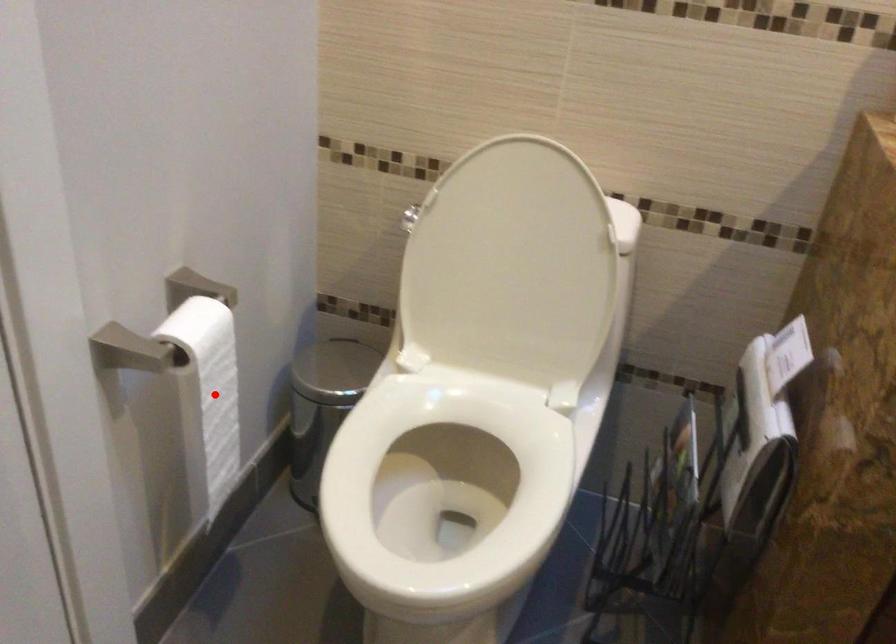
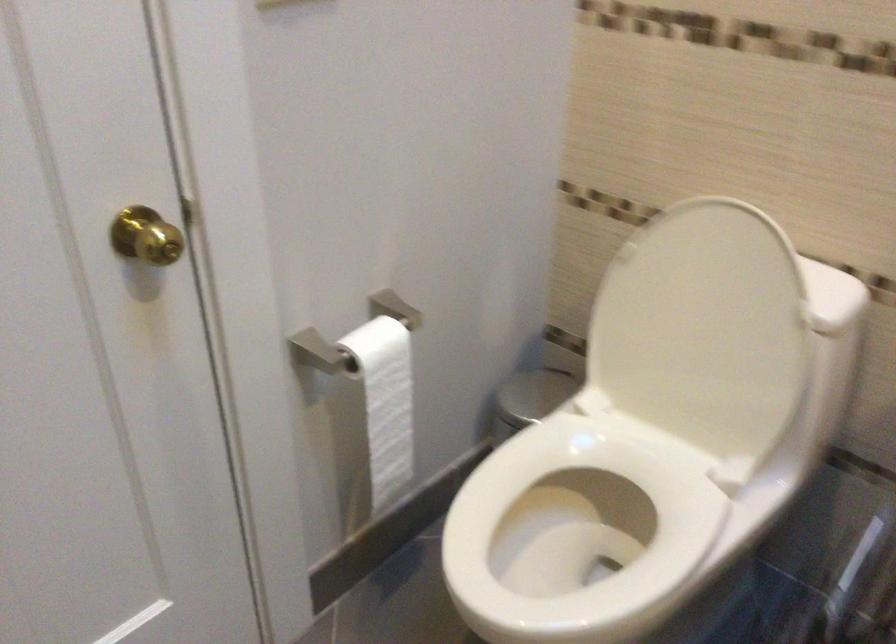
Question: I am providing you with two images of the same scene from different viewpoints. Image1 has a red point marked. In image2, the corresponding 3D location appears at what relative position? Reply with the corresponding letter.

Choices:
 (A) Closer
 (B) Farther

Answer: (B)